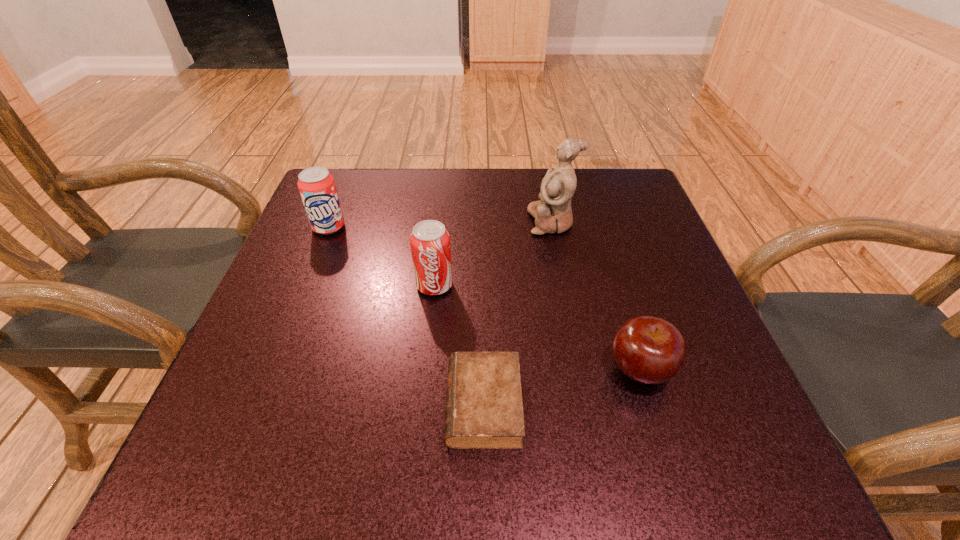
Where is `object that is at the left edge`? This screenshot has height=540, width=960. object that is at the left edge is located at coordinates (317, 187).

This screenshot has height=540, width=960. In order to click on object that is positioned at the right edge in this screenshot , I will do `click(649, 350)`.

Image resolution: width=960 pixels, height=540 pixels. In order to click on object located at the far left corner in this screenshot , I will do `click(317, 187)`.

This screenshot has height=540, width=960. What are the coordinates of `blank space at the far edge` in the screenshot? It's located at (441, 180).

The height and width of the screenshot is (540, 960). What are the coordinates of `vacant area at the near edge` in the screenshot? It's located at (472, 469).

Locate an element on the screen. vacant region at the right edge of the desktop is located at coordinates (599, 240).

Where is `vacant space at the far left corner of the desktop`? The image size is (960, 540). vacant space at the far left corner of the desktop is located at coordinates (341, 187).

Locate an element on the screen. vacant space at the near left corner is located at coordinates (247, 470).

This screenshot has width=960, height=540. In the image, there is a desktop. In order to click on free space at the far right corner in this screenshot , I will do `click(589, 191)`.

In the image, there is a desktop. In order to click on vacant region at the near right corner in this screenshot , I will do `click(681, 460)`.